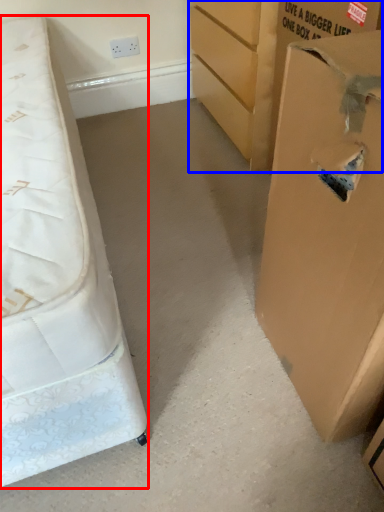
Question: Which object appears closest to the camera in this image, bed (highlighted by a red box) or cardboard box (highlighted by a blue box)?

Choices:
 (A) bed
 (B) cardboard box

Answer: (A)